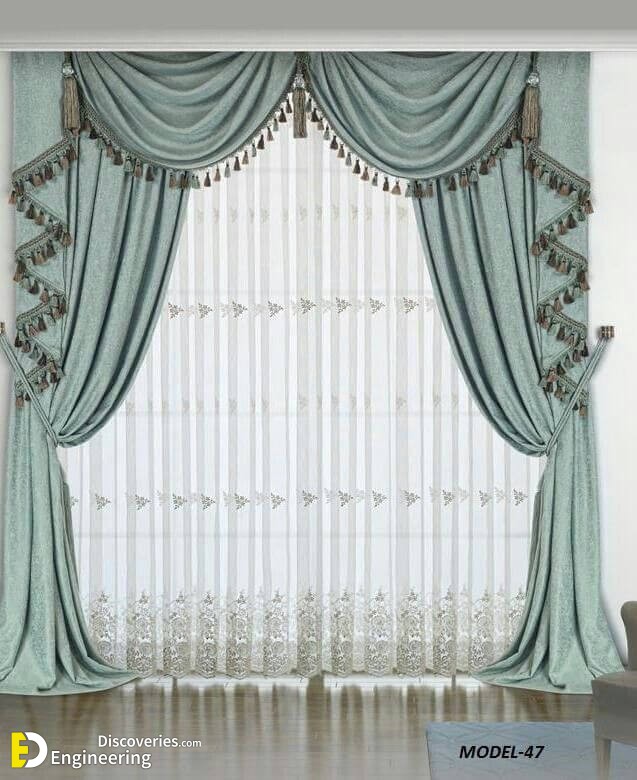
Find the location of a particular element. curtain is located at coordinates (462, 227), (104, 367), (255, 98), (290, 561).